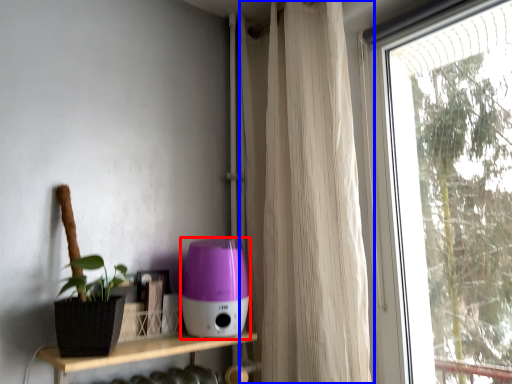
Question: Which point is closer to the camera, appliance (highlighted by a red box) or curtain (highlighted by a blue box)?

Choices:
 (A) appliance
 (B) curtain

Answer: (B)